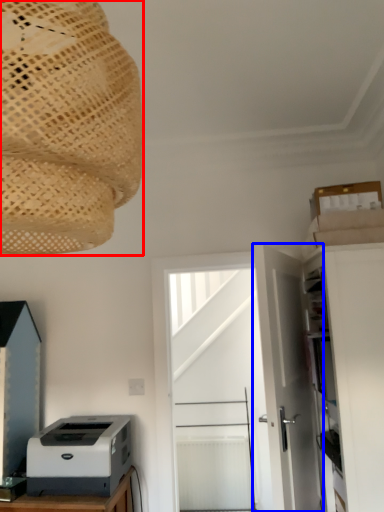
Question: Among these objects, which one is farthest to the camera, lamp (highlighted by a red box) or door (highlighted by a blue box)?

Choices:
 (A) lamp
 (B) door

Answer: (B)